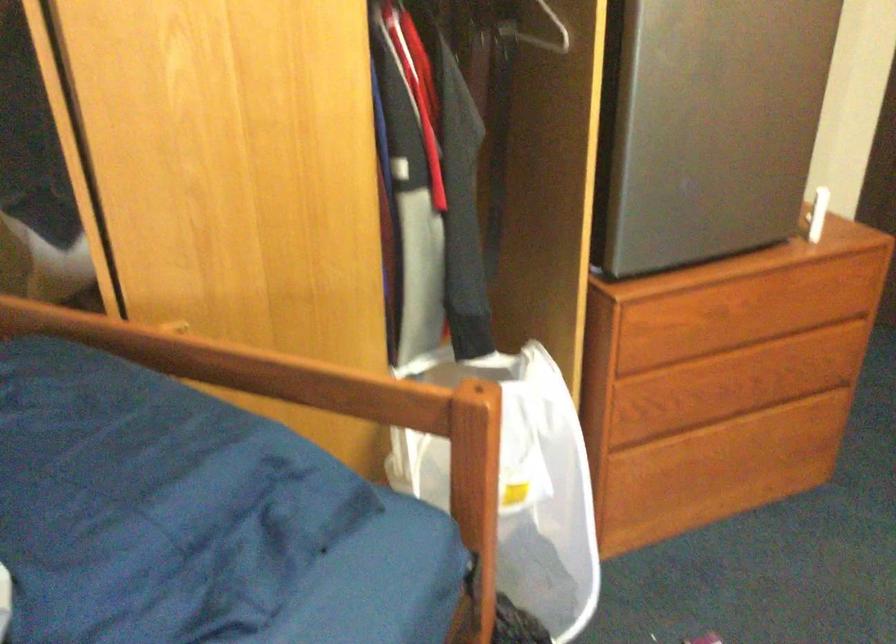
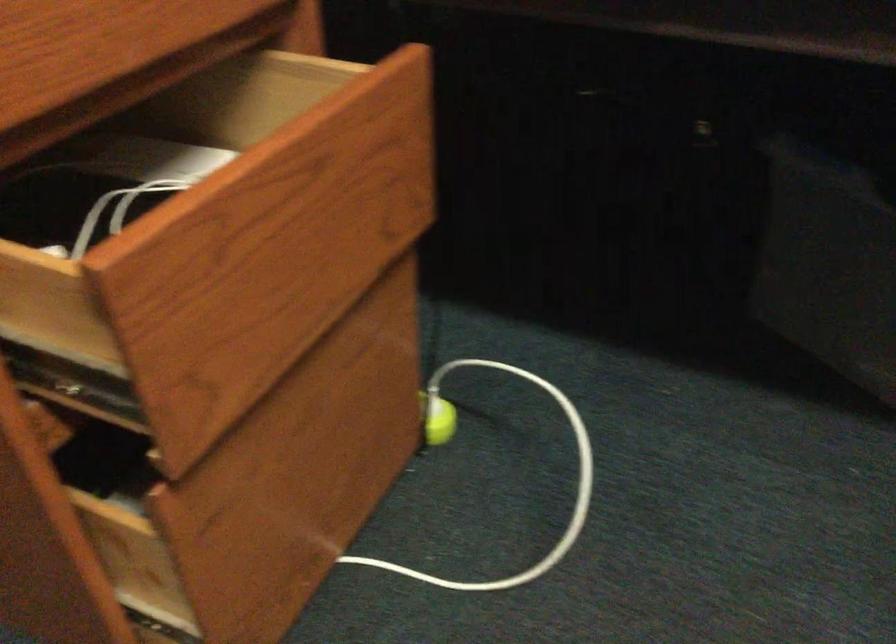
The first image is from the beginning of the video and the second image is from the end. How did the camera likely rotate when shooting the video?

The camera rotated toward left-down.